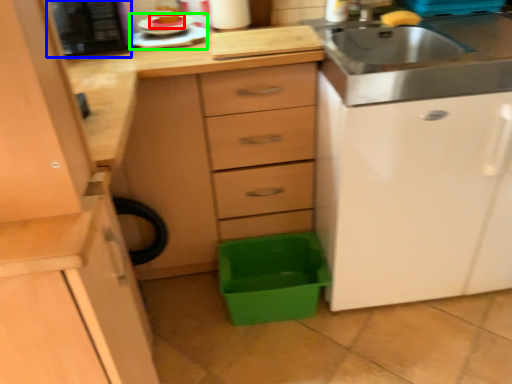
Question: Which object is positioned farthest from food (highlighted by a red box)? Select from appliance (highlighted by a blue box) and appliance (highlighted by a green box).

Choices:
 (A) appliance
 (B) appliance

Answer: (A)